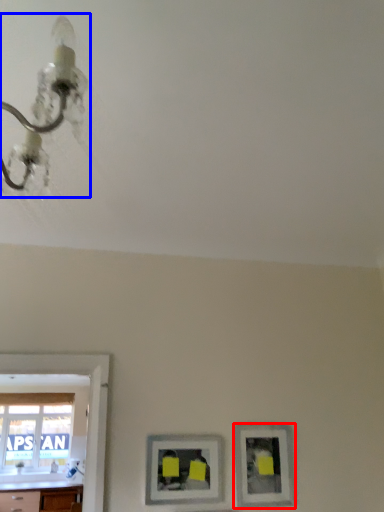
Question: Which point is further to the camera, picture frame (highlighted by a red box) or light fixture (highlighted by a blue box)?

Choices:
 (A) picture frame
 (B) light fixture

Answer: (A)